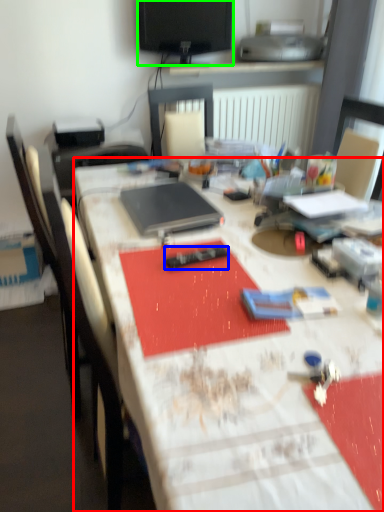
Question: Which object is the farthest from desk (highlighted by a red box)? Choose among these: remote control (highlighted by a blue box) or television (highlighted by a green box).

Choices:
 (A) remote control
 (B) television

Answer: (B)